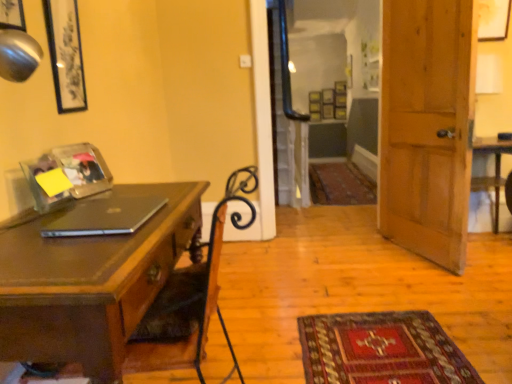
Question: Is sleek black laptop at left shorter than matte black picture frame at upper left, the 1th picture frame from the front?

Choices:
 (A) yes
 (B) no

Answer: (A)

Question: Is sleek black laptop at left closer to the viewer compared to matte black picture frame at upper left, which is counted as the 5th picture frame, starting from the right?

Choices:
 (A) no
 (B) yes

Answer: (B)

Question: Is sleek black laptop at left bigger than matte black picture frame at upper left, which appears as the first picture frame when viewed from the left?

Choices:
 (A) yes
 (B) no

Answer: (B)

Question: Are sleek black laptop at left and matte black picture frame at upper left, the 1th picture frame from the front, beside each other?

Choices:
 (A) no
 (B) yes

Answer: (A)

Question: Is sleek black laptop at left smaller than matte black picture frame at upper left, which appears as the first picture frame when viewed from the left?

Choices:
 (A) no
 (B) yes

Answer: (B)

Question: Considering the relative positions of sleek black laptop at left and matte black picture frame at upper left, which is counted as the 5th picture frame, starting from the right, in the image provided, is sleek black laptop at left to the right of matte black picture frame at upper left, which is counted as the 5th picture frame, starting from the right, from the viewer's perspective?

Choices:
 (A) no
 (B) yes

Answer: (B)

Question: Would you say wooden desk at left is outside matte black picture frame at upper left, which appears as the first picture frame when viewed from the left?

Choices:
 (A) no
 (B) yes

Answer: (B)

Question: Is wooden desk at left bigger than matte black picture frame at upper left, which is counted as the 5th picture frame, starting from the right?

Choices:
 (A) yes
 (B) no

Answer: (A)

Question: Considering the relative positions of wooden desk at left and matte black picture frame at upper left, which is counted as the 5th picture frame, starting from the right, in the image provided, is wooden desk at left to the left of matte black picture frame at upper left, which is counted as the 5th picture frame, starting from the right, from the viewer's perspective?

Choices:
 (A) yes
 (B) no

Answer: (B)

Question: Is the position of wooden desk at left more distant than that of matte black picture frame at upper left, which is counted as the 5th picture frame, starting from the right?

Choices:
 (A) yes
 (B) no

Answer: (B)

Question: From the image's perspective, is wooden desk at left located beneath matte black picture frame at upper left, the 1th picture frame from the front?

Choices:
 (A) yes
 (B) no

Answer: (A)

Question: Is wooden desk at left next to matte black picture frame at upper left, which appears as the first picture frame when viewed from the left, and touching it?

Choices:
 (A) no
 (B) yes

Answer: (A)

Question: Does clear plastic picture frame at upper left, which is the third picture frame in back-to-front order, have a smaller size compared to wooden picture frame at upper right, arranged as the fifth picture frame when viewed from the left?

Choices:
 (A) yes
 (B) no

Answer: (A)